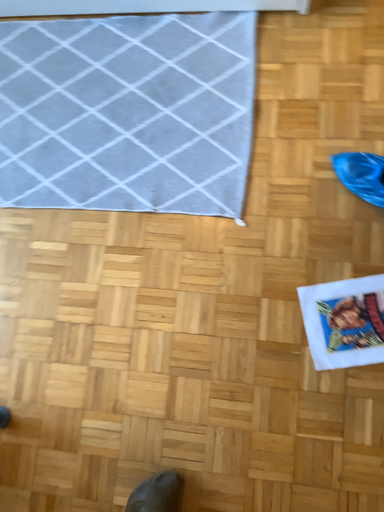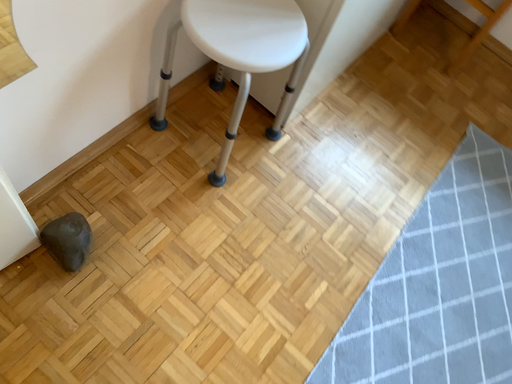
Question: Which way did the camera rotate in the video?

Choices:
 (A) rotated upward
 (B) rotated downward

Answer: (A)